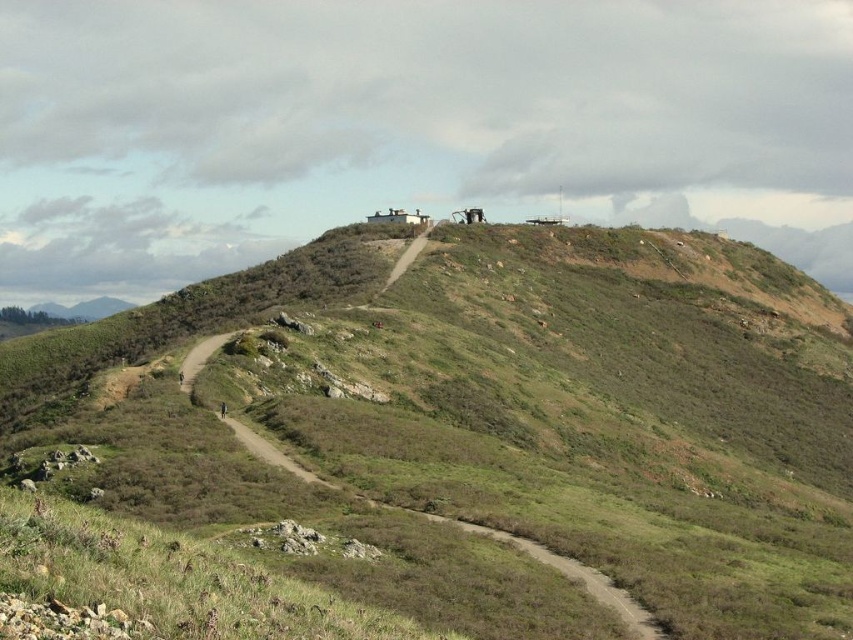
Is green grassy hill at upper center above brown dirt trail at center?

Yes.

Measure the distance between green grassy hill at upper center and brown dirt trail at center.

They are 223.76 feet apart.

Locate an element on the screen. Image resolution: width=853 pixels, height=640 pixels. green grassy hill at upper center is located at coordinates (503, 406).

Can you confirm if brown dirt trail at center is smaller than black fabric person at lower left?

Incorrect, brown dirt trail at center is not smaller in size than black fabric person at lower left.

Which is in front, point (320, 483) or point (221, 417)?

Point (320, 483)

This screenshot has height=640, width=853. I want to click on brown dirt trail at center, so click(x=556, y=570).

Which of these two, green grassy hill at upper center or brown leather jacket at lower left, stands taller?

green grassy hill at upper center is taller.

Which is more to the left, green grassy hill at upper center or brown leather jacket at lower left?

brown leather jacket at lower left

The height and width of the screenshot is (640, 853). I want to click on green grassy hill at upper center, so click(x=503, y=406).